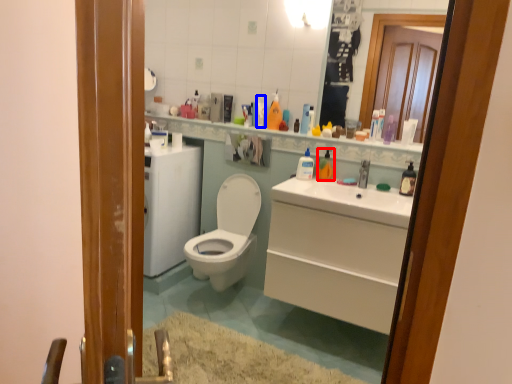
Question: Among these objects, which one is farthest to the camera, cleaning product (highlighted by a red box) or toiletry (highlighted by a blue box)?

Choices:
 (A) cleaning product
 (B) toiletry

Answer: (B)